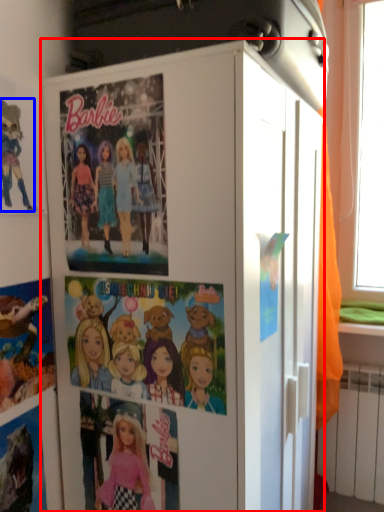
Question: Which of the following is the farthest to the observer, cabinetry (highlighted by a red box) or cartoon (highlighted by a blue box)?

Choices:
 (A) cabinetry
 (B) cartoon

Answer: (B)